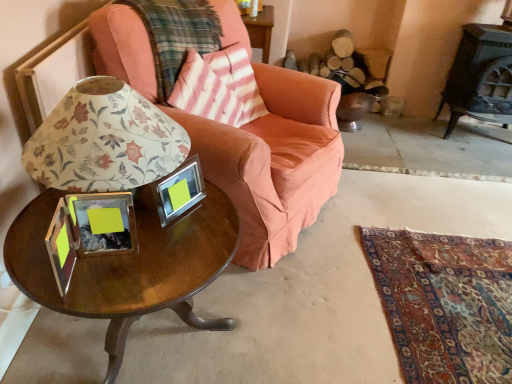
Image resolution: width=512 pixels, height=384 pixels. Find the location of `free spot to the right of velvet orange swivel chair at center`. free spot to the right of velvet orange swivel chair at center is located at coordinates (397, 129).